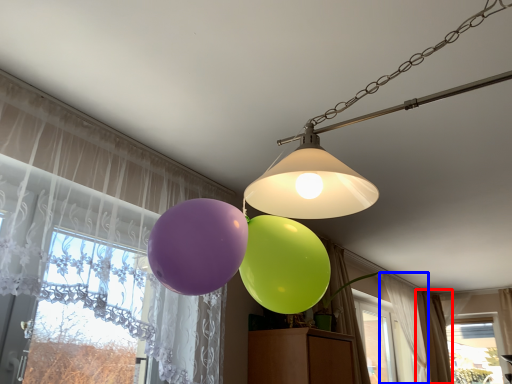
Question: Which point is closer to the camera, curtain (highlighted by a red box) or curtain (highlighted by a blue box)?

Choices:
 (A) curtain
 (B) curtain

Answer: (B)